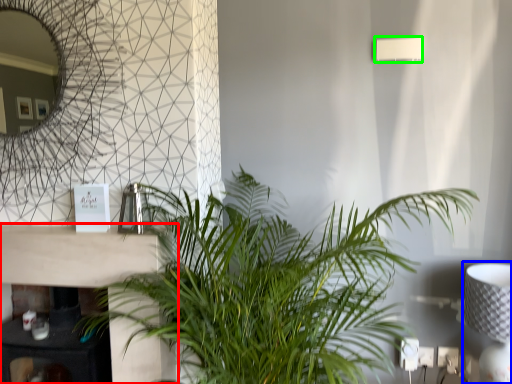
Question: Based on their relative distances, which object is nearer to table (highlighted by a red box)? Choose from table lamp (highlighted by a blue box) and lamp (highlighted by a green box).

Choices:
 (A) table lamp
 (B) lamp

Answer: (A)